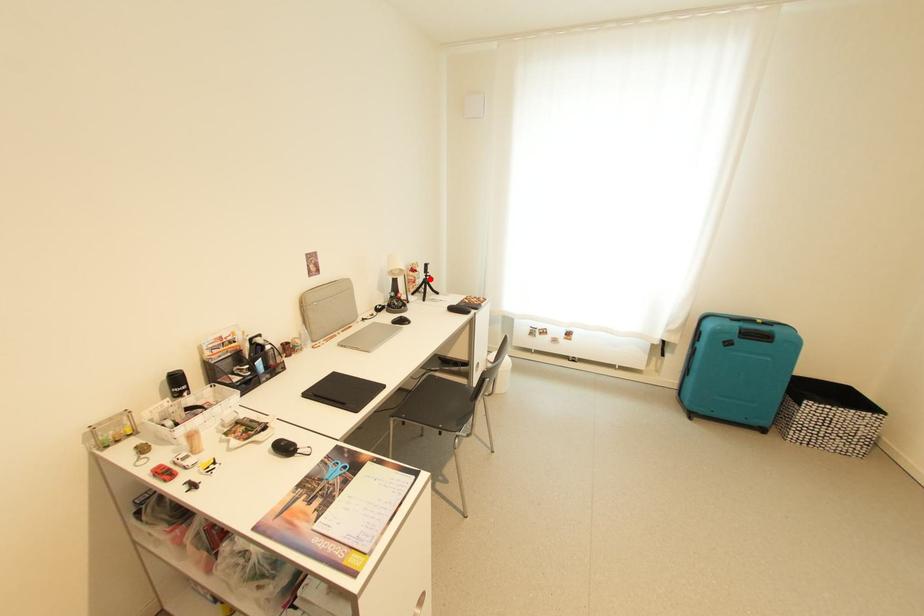
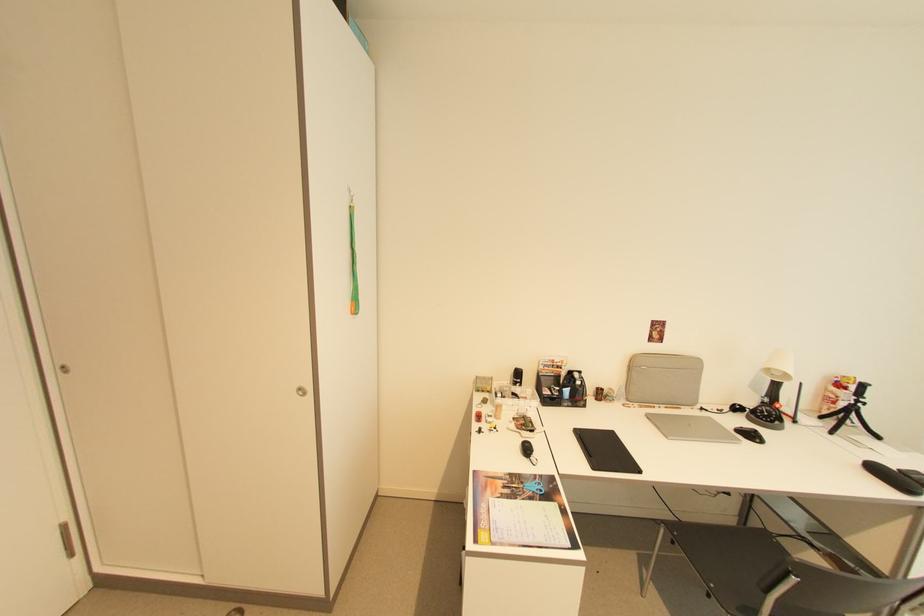
Where in the second image is the point corresponding to the highlighted location from the first image?

(857, 405)